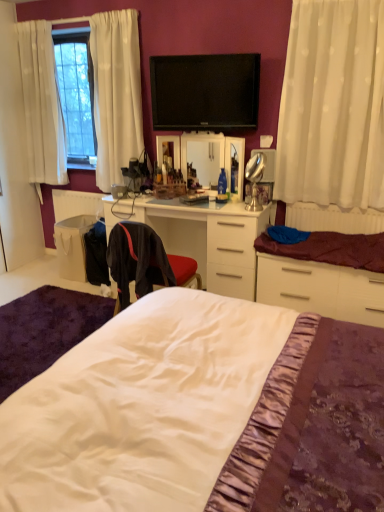
Image resolution: width=384 pixels, height=512 pixels. Find the location of `white fabric bag at lower left`. white fabric bag at lower left is located at coordinates (72, 246).

This screenshot has width=384, height=512. Describe the element at coordinates (331, 249) in the screenshot. I see `maroon satin blanket at right` at that location.

This screenshot has height=512, width=384. What are the coordinates of `white satin bed at center` in the screenshot? It's located at (313, 426).

In order to face white satin bed at center, should I rotate leftwards or rightwards?

To align with it, rotate left about 0.418°.

Measure the distance between point (155, 211) and camera.

Point (155, 211) and camera are 10.56 feet apart.

What do you see at coordinates (324, 275) in the screenshot? I see `white matte cabinet at right` at bounding box center [324, 275].

You are a GUI agent. You are given a task and a screenshot of the screen. Output one action in this format:
    pyautogui.click(x=<x>, y=<y>)
    Task: Click on the matte white mirror at center
    The image size is (384, 512).
    Given the screenshot: What is the action you would take?
    pyautogui.click(x=215, y=159)

At what (x,y) coordinates should I click in order to perform the action: click on white fabric bag at lower left. Please return your answer as a coordinate pair (x, y). Looking at the image, I should click on (72, 246).

Is silver metallic table lamp at center with flat screen tv at upper center?

No, silver metallic table lamp at center is not touching flat screen tv at upper center.

From the image's perspective, would you say silver metallic table lamp at center is positioned over flat screen tv at upper center?

Actually, silver metallic table lamp at center appears below flat screen tv at upper center in the image.

In the scene shown: Does silver metallic table lamp at center have a greater width compared to flat screen tv at upper center?

Indeed, silver metallic table lamp at center has a greater width compared to flat screen tv at upper center.

Identify the location of television above the silver metallic table lamp at center (from the image's perspective). Image resolution: width=384 pixels, height=512 pixels. (205, 92).

In the image, there is a silver metallic table lamp at center. Identify the location of curtain above it (from the image's perspective). (333, 105).

Is white sheer curtain at right not near silver metallic table lamp at center?

No, white sheer curtain at right is in close proximity to silver metallic table lamp at center.

How many degrees apart are the facing directions of white sheer curtain at right and silver metallic table lamp at center?

There is a 45.6-degree angle between the facing directions of white sheer curtain at right and silver metallic table lamp at center.

Between white sheer curtain at right and silver metallic table lamp at center, which one has larger size?

white sheer curtain at right.

Is white sheer curtain at right closer to camera compared to matte white mirror at center?

Yes, it is.

Is white sheer curtain at right taller or shorter than matte white mirror at center?

white sheer curtain at right is taller than matte white mirror at center.

Looking at the image, does white sheer curtain at right seem bigger or smaller compared to matte white mirror at center?

Considering their sizes, white sheer curtain at right takes up more space than matte white mirror at center.

Which is correct: white sheer curtain at right is inside matte white mirror at center, or outside of it?

white sheer curtain at right lies outside matte white mirror at center.

Is point (331, 306) positioned after point (227, 145)?

No.

Could you tell me if white matte cabinet at right is facing matte white mirror at center?

No, white matte cabinet at right does not turn towards matte white mirror at center.

Would you say white matte cabinet at right is outside matte white mirror at center?

That's correct, white matte cabinet at right is outside of matte white mirror at center.

From the image's perspective, is white matte cabinet at right positioned above or below matte white mirror at center?

Based on their image positions, white matte cabinet at right is located beneath matte white mirror at center.

Can you see black fabric chair at center touching white fabric bag at lower left?

There is a gap between black fabric chair at center and white fabric bag at lower left.

From the image's perspective, between black fabric chair at center and white fabric bag at lower left, which one is located above?

From the image's view, white fabric bag at lower left is above.

Considering the sizes of objects black fabric chair at center and white fabric bag at lower left in the image provided, who is smaller, black fabric chair at center or white fabric bag at lower left?

white fabric bag at lower left.

At what (x,y) coordinates should I click in order to perform the action: click on chair lying below the white fabric bag at lower left (from the image's perspective). Please return your answer as a coordinate pair (x, y). The height and width of the screenshot is (512, 384). Looking at the image, I should click on (145, 262).

Measure the distance between white satin bed at center and white matte cabinet at right.

They are 5.14 feet apart.

What's the angular difference between white satin bed at center and white matte cabinet at right's facing directions?

The facing directions of white satin bed at center and white matte cabinet at right are 89.2 degrees apart.

Consider the image. Does white satin bed at center appear on the right side of white matte cabinet at right?

In fact, white satin bed at center is to the left of white matte cabinet at right.

Where is `cabinetry beneath the white satin bed at center (from a real-world perspective)`? Image resolution: width=384 pixels, height=512 pixels. cabinetry beneath the white satin bed at center (from a real-world perspective) is located at coordinates (324, 275).

Identify the location of bed in front of the white sheer curtain at right. The height and width of the screenshot is (512, 384). (313, 426).

Considering the positions of objects white satin bed at center and white sheer curtain at right in the image provided, who is behind, white satin bed at center or white sheer curtain at right?

white sheer curtain at right is behind.

Considering the positions of points (80, 312) and (289, 38), is point (80, 312) closer to camera compared to point (289, 38)?

No.

Consider the image. From the image's perspective, is white satin bed at center located beneath white sheer curtain at right?

Yes.

You are a GUI agent. You are given a task and a screenshot of the screen. Output one action in this format:
    pyautogui.click(x=<x>, y=<y>)
    Task: Click on the table lamp on the right of flat screen tv at upper center
    The height and width of the screenshot is (512, 384).
    Given the screenshot: What is the action you would take?
    pyautogui.click(x=255, y=179)

Locate an element on the screen. Image resolution: width=384 pixels, height=512 pixels. table lamp located on the left of white sheer curtain at right is located at coordinates (255, 179).

Consider the image. Estimate the real-world distances between objects in this image. Which object is further from black fabric chair at center, white matte cabinet at right or white plastic radiator at right?

white plastic radiator at right is further to black fabric chair at center.

Looking at the image, which one is located further to matte white mirror at center, black fabric chair at center or white matte cabinet at right?

black fabric chair at center.

Considering their positions, is white matte cabinet at right positioned closer to white satin bed at center than white plastic radiator at right?

white matte cabinet at right is positioned closer to the anchor white satin bed at center.

Based on their spatial positions, is silver metallic table lamp at center or matte white mirror at center closer to black fabric chair at center?

silver metallic table lamp at center is closer to black fabric chair at center.

Looking at the image, which one is located closer to white fabric bag at lower left, silver metallic table lamp at center or flat screen tv at upper center?

Among the two, flat screen tv at upper center is located nearer to white fabric bag at lower left.

Considering their positions, is white sheer curtain at right positioned further to maroon satin blanket at right than flat screen tv at upper center?

The object further to maroon satin blanket at right is flat screen tv at upper center.

Estimate the real-world distances between objects in this image. Which object is closer to flat screen tv at upper center, matte white mirror at center or white sheer curtain at right?

The object closer to flat screen tv at upper center is matte white mirror at center.

When comparing their distances from black fabric chair at center, does white glossy desk at center or matte white mirror at center seem further?

matte white mirror at center lies further to black fabric chair at center than the other object.

At what (x,y) coordinates should I click in order to perform the action: click on curtain between flat screen tv at upper center and white glossy desk at center in the vertical direction. Please return your answer as a coordinate pair (x, y). The height and width of the screenshot is (512, 384). Looking at the image, I should click on (333, 105).

Find the location of a particular element. blanket located between white satin bed at center and white plastic radiator at right in the depth direction is located at coordinates (331, 249).

Identify the location of table lamp between white satin bed at center and white glossy desk at center from front to back. (255, 179).

At what (x,y) coordinates should I click in order to perform the action: click on table lamp between white satin bed at center and white fabric bag at lower left along the z-axis. Please return your answer as a coordinate pair (x, y). The width and height of the screenshot is (384, 512). Looking at the image, I should click on (255, 179).